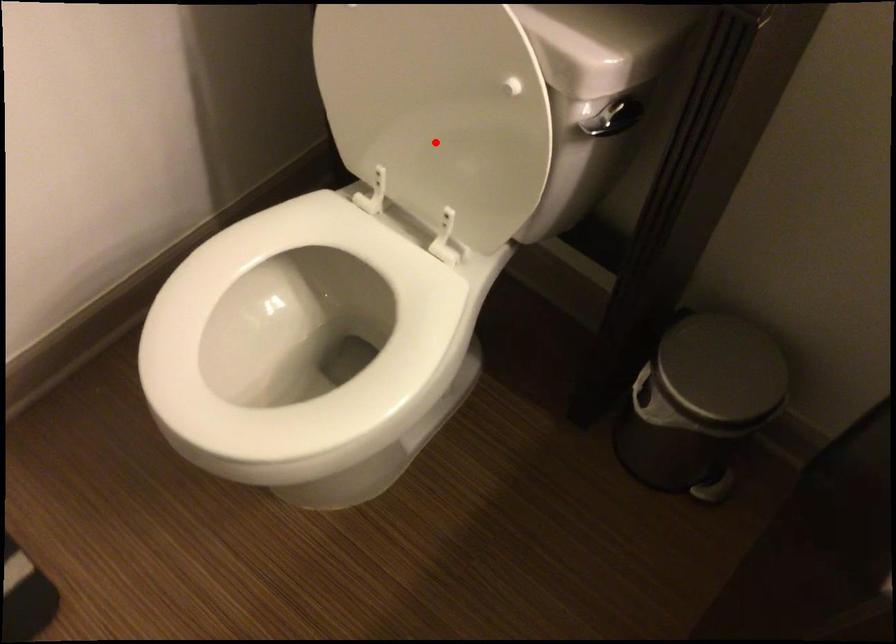
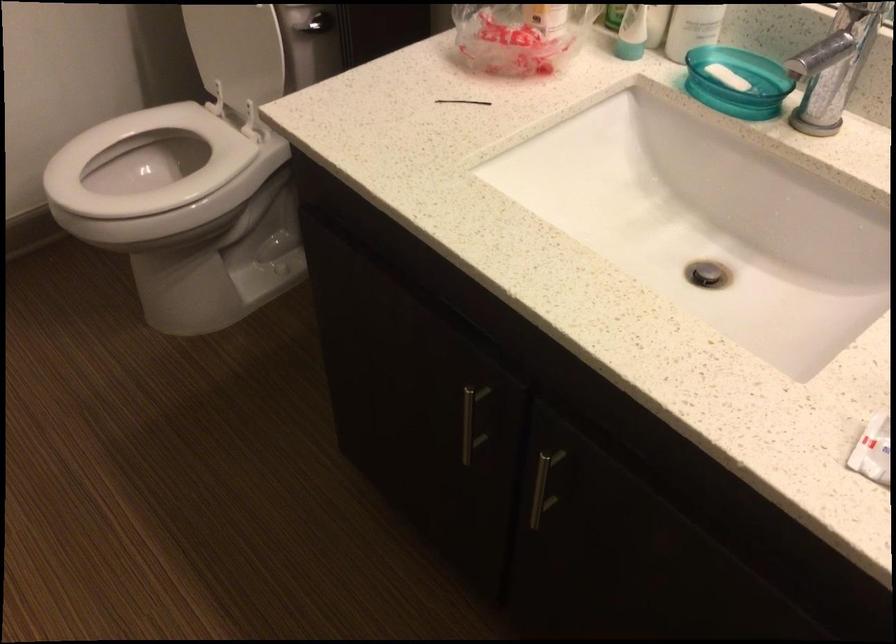
Question: I am providing you with two images of the same scene from different viewpoints. Image1 has a red point marked. In image2, the corresponding 3D location appears at what relative position? Reply with the corresponding letter.

Choices:
 (A) Closer
 (B) Farther

Answer: (B)